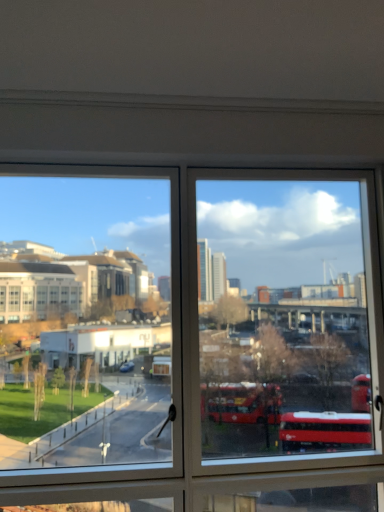
Describe the element at coordinates (283, 338) in the screenshot. I see `transparent glass window at center` at that location.

In order to face transparent glass window at center, should I rotate leftwards or rightwards?

It's best to rotate right around 1.916 degrees.

Where is `transparent glass window at center`? transparent glass window at center is located at coordinates (283, 338).

The height and width of the screenshot is (512, 384). I want to click on transparent glass window at center, so click(x=283, y=338).